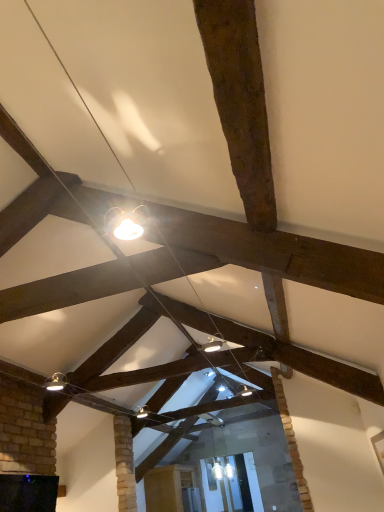
What are the coordinates of `wooden cabinet at center` in the screenshot? It's located at (168, 486).

What do you see at coordinates (168, 486) in the screenshot? The width and height of the screenshot is (384, 512). I see `wooden cabinet at center` at bounding box center [168, 486].

What do you see at coordinates (56, 382) in the screenshot? I see `matte silver lamp at lower left` at bounding box center [56, 382].

Where is `matte silver lamp at lower left`? matte silver lamp at lower left is located at coordinates click(x=56, y=382).

The image size is (384, 512). I want to click on wooden cabinet at center, so click(x=168, y=486).

Considering the relative positions of matte silver lamp at lower left and wooden cabinet at center in the image provided, is matte silver lamp at lower left to the left of wooden cabinet at center from the viewer's perspective?

Correct, you'll find matte silver lamp at lower left to the left of wooden cabinet at center.

Which is behind, matte silver lamp at lower left or wooden cabinet at center?

wooden cabinet at center is more distant.

Is point (51, 391) closer or farther from the camera than point (151, 470)?

Point (51, 391).

From the image's perspective, is matte silver lamp at lower left under wooden cabinet at center?

Actually, matte silver lamp at lower left appears above wooden cabinet at center in the image.

From a real-world perspective, who is located lower, matte silver lamp at lower left or wooden cabinet at center?

wooden cabinet at center is physically lower.

Which of these two, matte silver lamp at lower left or wooden cabinet at center, is wider?

With larger width is wooden cabinet at center.

Is matte silver lamp at lower left shorter than wooden cabinet at center?

Indeed, matte silver lamp at lower left has a lesser height compared to wooden cabinet at center.

Can you confirm if matte silver lamp at lower left is bigger than wooden cabinet at center?

Actually, matte silver lamp at lower left might be smaller than wooden cabinet at center.

Is matte silver lamp at lower left outside of wooden cabinet at center?

Yes, matte silver lamp at lower left is located beyond the bounds of wooden cabinet at center.

Are matte silver lamp at lower left and wooden cabinet at center located far from each other?

Yes, matte silver lamp at lower left and wooden cabinet at center are located far from each other.

Is matte silver lamp at lower left facing towards wooden cabinet at center?

Yes, matte silver lamp at lower left is facing wooden cabinet at center.

Locate an element on the screen. Image resolution: width=384 pixels, height=512 pixels. furniture lying below the matte silver lamp at lower left (from the image's perspective) is located at coordinates click(168, 486).

Which object is positioned more to the right, wooden cabinet at center or matte silver lamp at lower left?

From the viewer's perspective, wooden cabinet at center appears more on the right side.

Considering their positions, is wooden cabinet at center located in front of or behind matte silver lamp at lower left?

In the image, wooden cabinet at center appears behind matte silver lamp at lower left.

Is point (169, 474) closer or farther from the camera than point (57, 379)?

Point (169, 474) appears to be farther away from the viewer than point (57, 379).

From the image's perspective, is wooden cabinet at center above or below matte silver lamp at lower left?

From the image's perspective, wooden cabinet at center appears below matte silver lamp at lower left.

From a real-world perspective, is wooden cabinet at center on top of matte silver lamp at lower left?

No, from a real-world perspective, wooden cabinet at center is not above matte silver lamp at lower left.

Considering the relative sizes of wooden cabinet at center and matte silver lamp at lower left in the image provided, is wooden cabinet at center wider than matte silver lamp at lower left?

Yes.

Is wooden cabinet at center taller or shorter than matte silver lamp at lower left?

Clearly, wooden cabinet at center is taller compared to matte silver lamp at lower left.

Considering the sizes of objects wooden cabinet at center and matte silver lamp at lower left in the image provided, who is smaller, wooden cabinet at center or matte silver lamp at lower left?

With smaller size is matte silver lamp at lower left.

Do you think wooden cabinet at center is within matte silver lamp at lower left, or outside of it?

wooden cabinet at center is outside matte silver lamp at lower left.

From the picture: Would you say wooden cabinet at center is a long distance from matte silver lamp at lower left?

Yes, wooden cabinet at center and matte silver lamp at lower left are located far from each other.

Is wooden cabinet at center turned away from matte silver lamp at lower left?

No, matte silver lamp at lower left is not at the back of wooden cabinet at center.

What's the angular difference between wooden cabinet at center and matte silver lamp at lower left's facing directions?

89.4 degrees separate the facing orientations of wooden cabinet at center and matte silver lamp at lower left.

Identify the location of furniture below the matte silver lamp at lower left (from a real-world perspective). This screenshot has width=384, height=512. (168, 486).

This screenshot has width=384, height=512. I want to click on furniture located below the matte silver lamp at lower left (from the image's perspective), so click(x=168, y=486).

Where is `furniture behind the matte silver lamp at lower left`? The height and width of the screenshot is (512, 384). furniture behind the matte silver lamp at lower left is located at coordinates (168, 486).